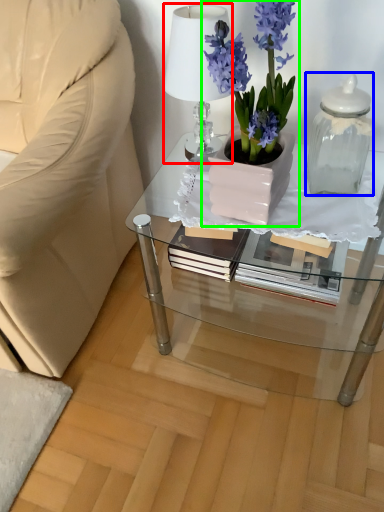
Question: Based on their relative distances, which object is farther from lamp (highlighted by a red box)? Choose from bottle (highlighted by a blue box) and houseplant (highlighted by a green box).

Choices:
 (A) bottle
 (B) houseplant

Answer: (A)